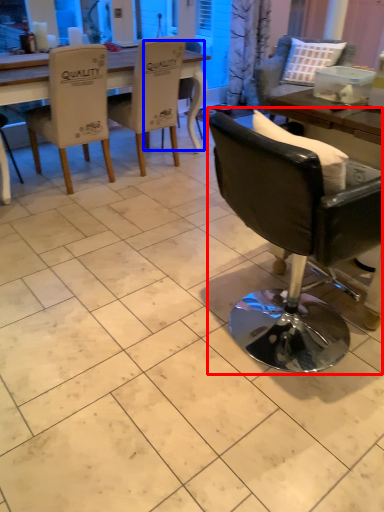
Question: Which of the following is the farthest to the observer, chair (highlighted by a red box) or chair (highlighted by a blue box)?

Choices:
 (A) chair
 (B) chair

Answer: (B)